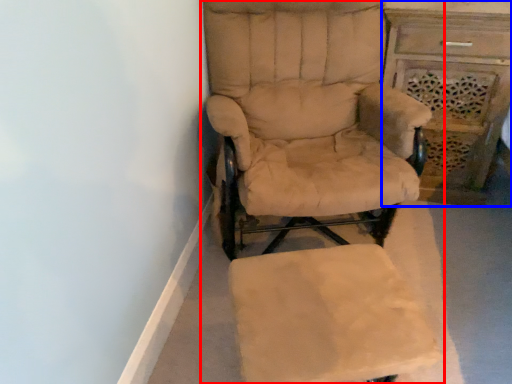
Question: Which object is closer to the camera taking this photo, chair (highlighted by a red box) or vanity (highlighted by a blue box)?

Choices:
 (A) chair
 (B) vanity

Answer: (A)